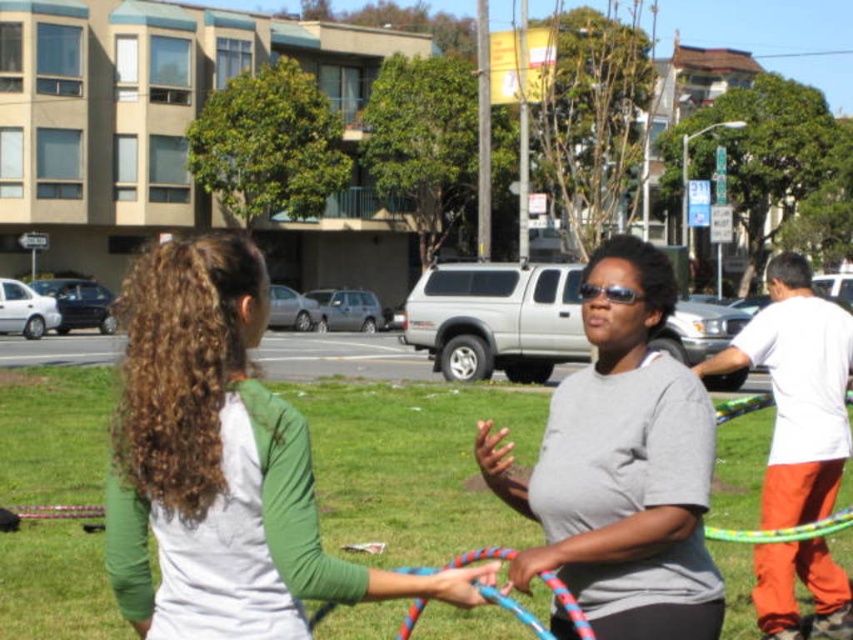
Can you confirm if green fabric shirt at center is bigger than gray matte shirt at center?

Indeed, green fabric shirt at center has a larger size compared to gray matte shirt at center.

Can you confirm if green fabric shirt at center is thinner than gray matte shirt at center?

Incorrect, green fabric shirt at center's width is not less than gray matte shirt at center's.

This screenshot has width=853, height=640. Find the location of `green fabric shirt at center`. green fabric shirt at center is located at coordinates (219, 465).

Can you confirm if green grass at center is positioned to the left of green fabric shirt at center?

In fact, green grass at center is to the right of green fabric shirt at center.

In the scene shown: Who is positioned more to the right, green grass at center or green fabric shirt at center?

Positioned to the right is green grass at center.

Who is more distant from viewer, (3, 376) or (265, 317)?

Result: The point (3, 376) is behind.

This screenshot has width=853, height=640. Identify the location of green grass at center. (410, 467).

Can you confirm if green grass at center is positioned to the right of gray matte shirt at center?

Incorrect, green grass at center is not on the right side of gray matte shirt at center.

Is green grass at center positioned at the back of gray matte shirt at center?

Yes, green grass at center is further from the viewer.

Is point (318, 472) in front of point (660, 531)?

No.

Where is `green grass at center`? This screenshot has height=640, width=853. green grass at center is located at coordinates (410, 467).